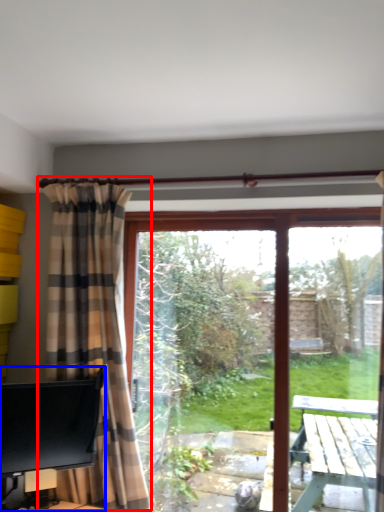
Question: Which point is closer to the camera, curtain (highlighted by a red box) or desk (highlighted by a blue box)?

Choices:
 (A) curtain
 (B) desk

Answer: (B)